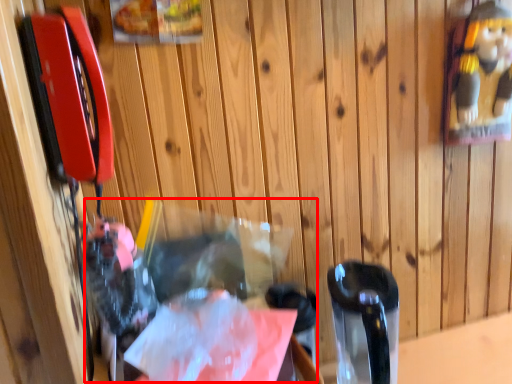
Question: In this image, where is waste (annotated by the red box) located relative to wrapping paper?

Choices:
 (A) right
 (B) left

Answer: (B)